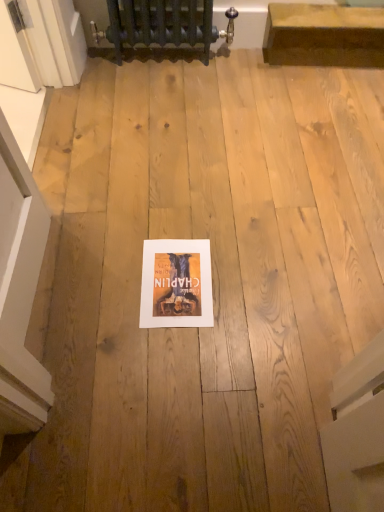
I want to click on empty space that is ontop of matte paper poster at center (from a real-world perspective), so click(177, 274).